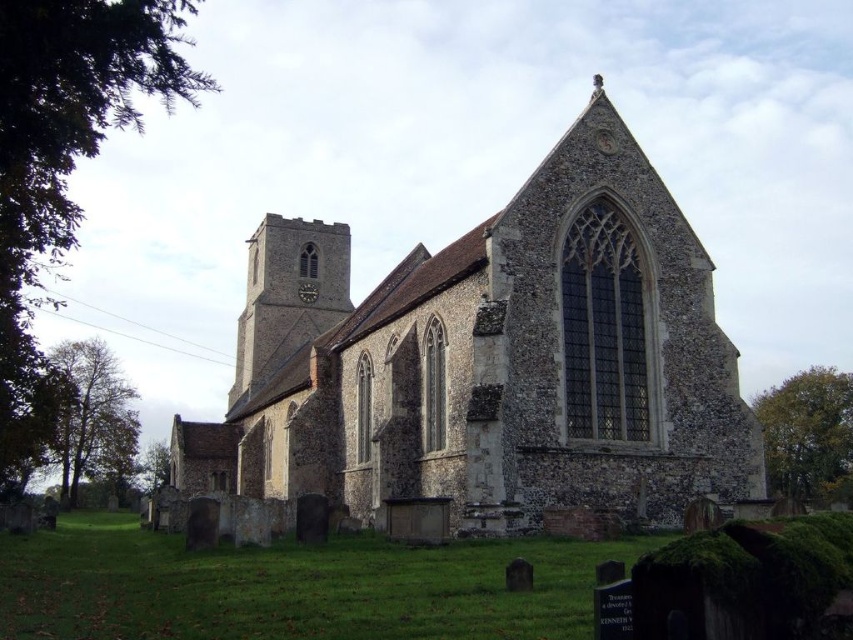
Is brown stone church at center shorter than stone clock tower at center-left?

No.

Can you confirm if brown stone church at center is taller than stone clock tower at center-left?

Indeed, brown stone church at center has a greater height compared to stone clock tower at center-left.

Identify the location of brown stone church at center. (491, 360).